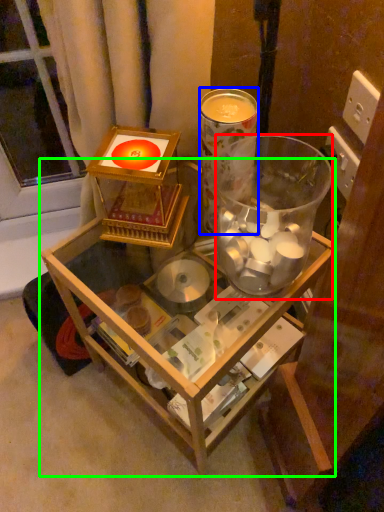
Question: Which is nearer to the beverage (highlighted by a red box)? beverage (highlighted by a blue box) or table (highlighted by a green box).

Choices:
 (A) beverage
 (B) table

Answer: (A)